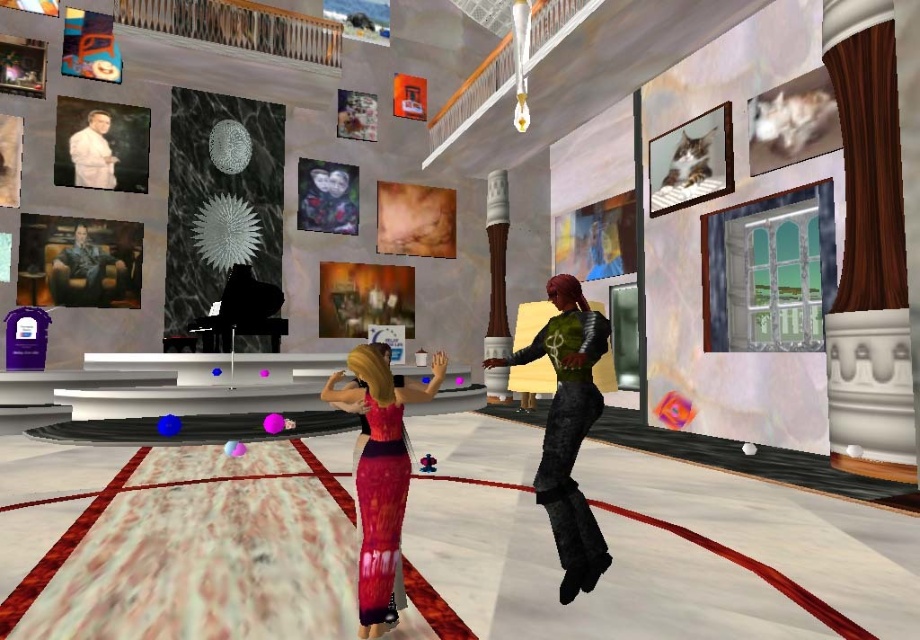
You are an observer standing in the room described. You notice the knitted pink dress at center and the white matte suit at upper left. Which object is positioned lower in the scene?

The knitted pink dress at center is located below the white matte suit at upper left, so it is positioned lower in the scene.

Based on the coordinates provided, which object is located at point (380, 476) in the image?

The knitted pink dress at center is located at point (380, 476).